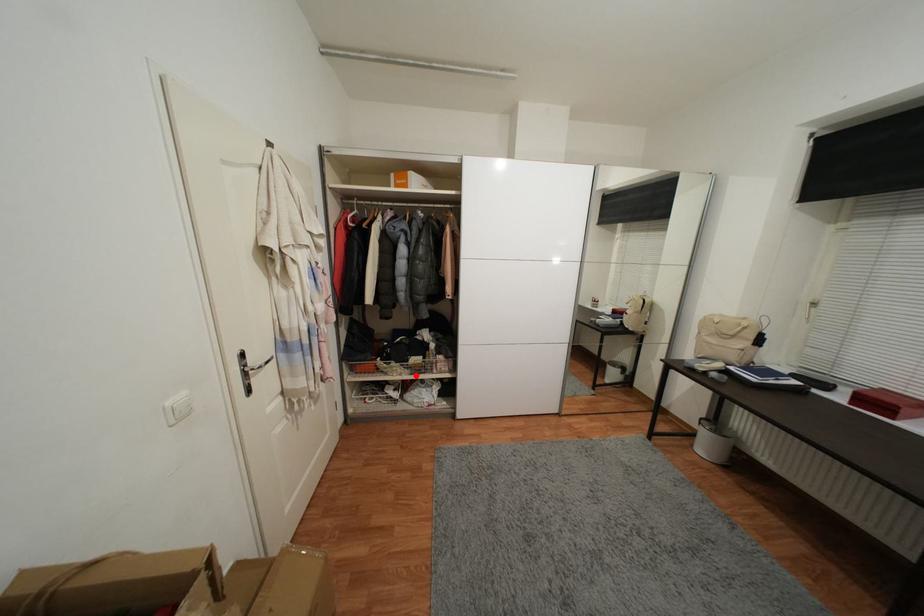
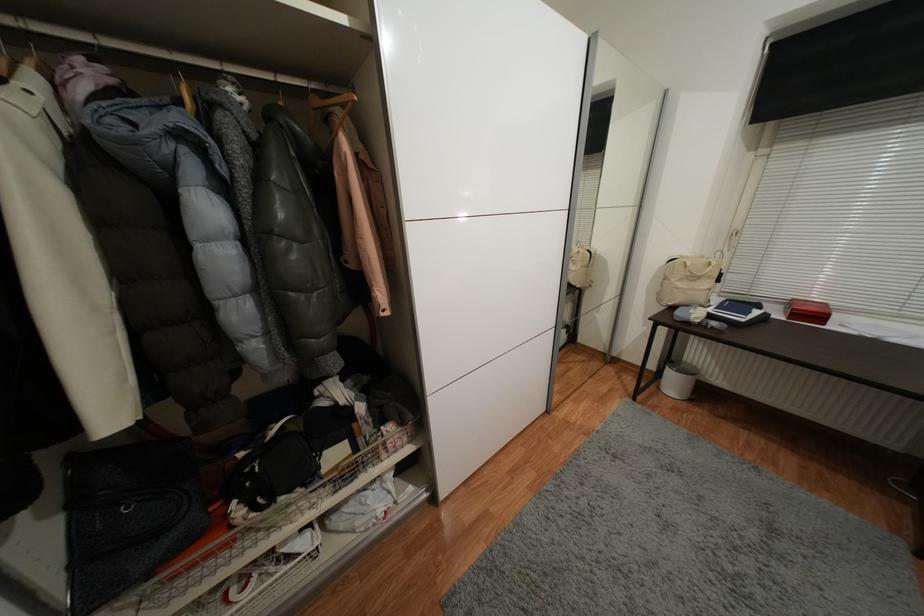
The point at the highlighted location is marked in the first image. Where is the corresponding point in the second image?

(342, 493)